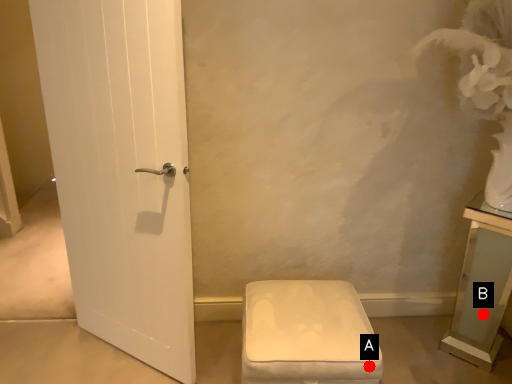
Question: Two points are circled on the image, labeled by A and B beside each circle. Which of the following is the farthest from the observer?

Choices:
 (A) A is further
 (B) B is further

Answer: (B)